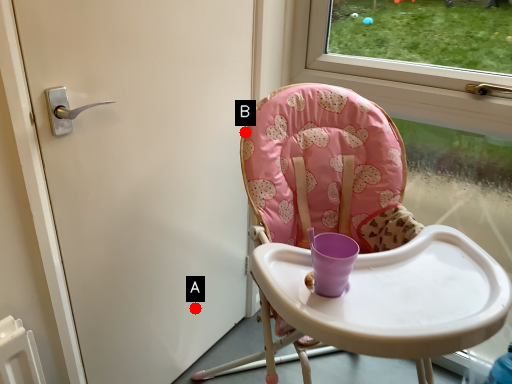
Question: Two points are circled on the image, labeled by A and B beside each circle. Which point is closer to the camera?

Choices:
 (A) A is closer
 (B) B is closer

Answer: (B)